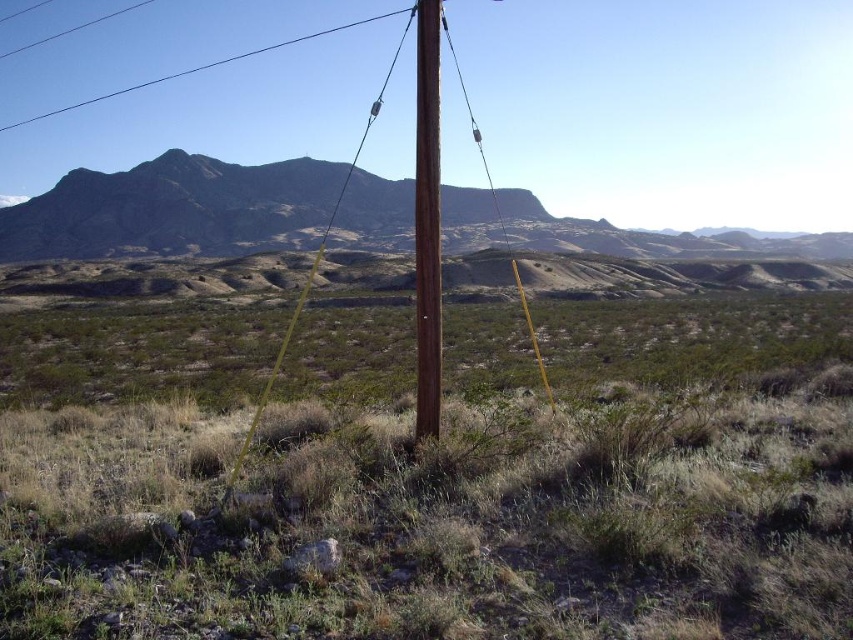
You are a hiker who wants to take a photo of the brown wood pole at center and the green grass at center. Which object should you focus on first if you want to capture both in the same frame without moving your camera?

The green grass at center is positioned on the left side of brown wood pole at center, so you should focus on the brown wood pole at center first to ensure both are in the frame.